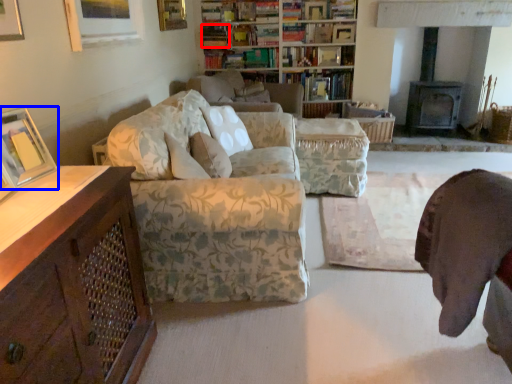
Question: Among these objects, which one is farthest to the camera, book (highlighted by a red box) or picture frame (highlighted by a blue box)?

Choices:
 (A) book
 (B) picture frame

Answer: (A)